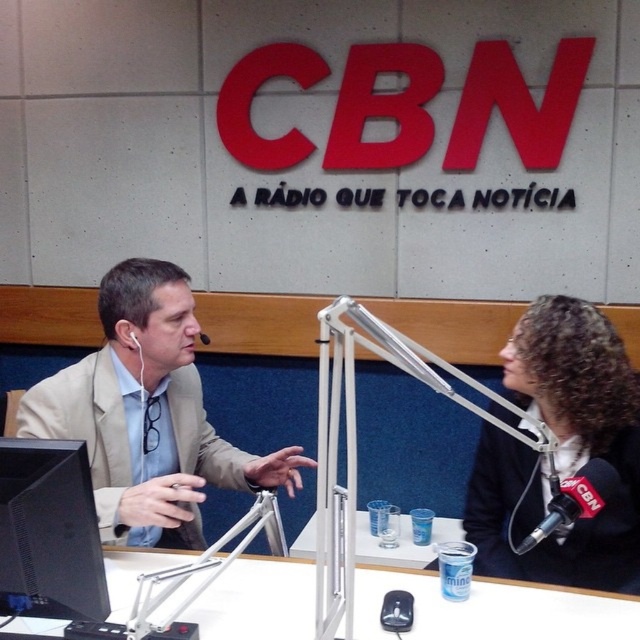
Does beige fabric suit at left appear on the left side of white earphone at left?

No, beige fabric suit at left is not to the left of white earphone at left.

Between point (147, 284) and point (132, 336), which one is positioned behind?

The point (132, 336) is behind.

In order to click on beige fabric suit at left in this screenshot , I will do `click(148, 413)`.

Can you confirm if beige fabric suit at left is thinner than black metallic microphone at center?

Incorrect, beige fabric suit at left's width is not less than black metallic microphone at center's.

Is point (268, 477) farther from viewer compared to point (205, 337)?

No, (268, 477) is in front of (205, 337).

The image size is (640, 640). What do you see at coordinates (148, 413) in the screenshot?
I see `beige fabric suit at left` at bounding box center [148, 413].

Locate an element on the screen. The height and width of the screenshot is (640, 640). beige fabric suit at left is located at coordinates (148, 413).

Who is more distant from viewer, [20,460] or [132,333]?

Point [132,333]

Consider the image. Can you confirm if black plastic monitor at lower left is shorter than white earphone at left?

No, black plastic monitor at lower left is not shorter than white earphone at left.

At what (x,y) coordinates should I click in order to perform the action: click on black plastic monitor at lower left. Please return your answer as a coordinate pair (x, y). This screenshot has height=640, width=640. Looking at the image, I should click on (49, 532).

I want to click on black plastic monitor at lower left, so click(x=49, y=532).